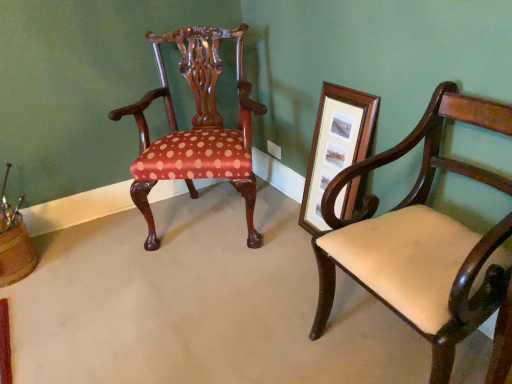
This screenshot has width=512, height=384. What are the coordinates of `vacant space underneath polished wood chair at center, arranged as the second chair when viewed from the front (from a real-world perspective)` in the screenshot? It's located at (207, 223).